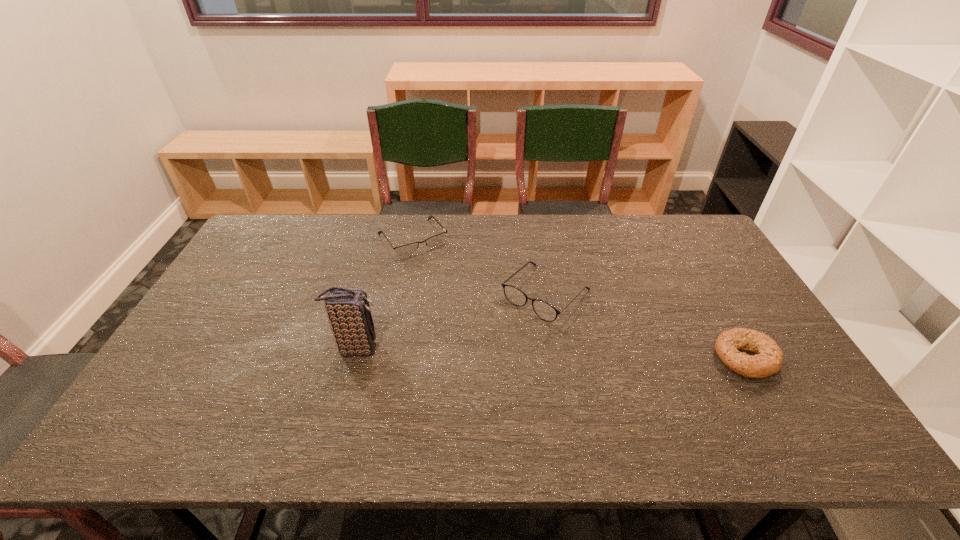
Where is `unoccupied position between the tallest object and the third nearest object`? This screenshot has height=540, width=960. unoccupied position between the tallest object and the third nearest object is located at coordinates (451, 321).

This screenshot has height=540, width=960. I want to click on unoccupied position between the tallest object and the farther spectacles, so click(384, 293).

This screenshot has height=540, width=960. Find the location of `empty space that is in between the rightmost object and the farthest object`. empty space that is in between the rightmost object and the farthest object is located at coordinates (579, 298).

Where is `free space that is in between the left spectacles and the tallest object`? The height and width of the screenshot is (540, 960). free space that is in between the left spectacles and the tallest object is located at coordinates (384, 293).

This screenshot has height=540, width=960. I want to click on object that is the third closest one to the rightmost object, so click(x=348, y=310).

Locate which object is the closest to the farther spectacles. Please provide its 2D coordinates. Your answer should be formatted as a tuple, i.e. [(x, y)], where the tuple contains the x and y coordinates of a point satisfying the conditions above.

[(544, 310)]